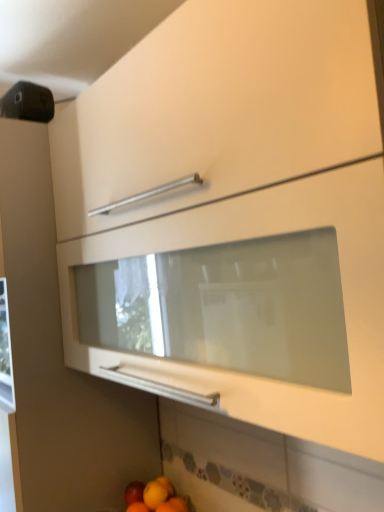
Question: Is matte orange at lower center wider or thinner than matte red apple at lower left?

Choices:
 (A) wide
 (B) thin

Answer: (A)

Question: In the image, is matte orange at lower center on the left side or the right side of matte red apple at lower left?

Choices:
 (A) left
 (B) right

Answer: (B)

Question: Considering their positions, is matte orange at lower center located in front of or behind matte red apple at lower left?

Choices:
 (A) front
 (B) behind

Answer: (A)

Question: Looking at the image, does matte red apple at lower left seem bigger or smaller compared to matte orange at lower center?

Choices:
 (A) big
 (B) small

Answer: (B)

Question: Is matte red apple at lower left situated inside matte orange at lower center or outside?

Choices:
 (A) outside
 (B) inside

Answer: (A)

Question: Is matte red apple at lower left to the left or to the right of matte orange at lower center in the image?

Choices:
 (A) left
 (B) right

Answer: (A)

Question: From the image's perspective, relative to matte orange at lower center, is matte red apple at lower left above or below?

Choices:
 (A) above
 (B) below

Answer: (B)